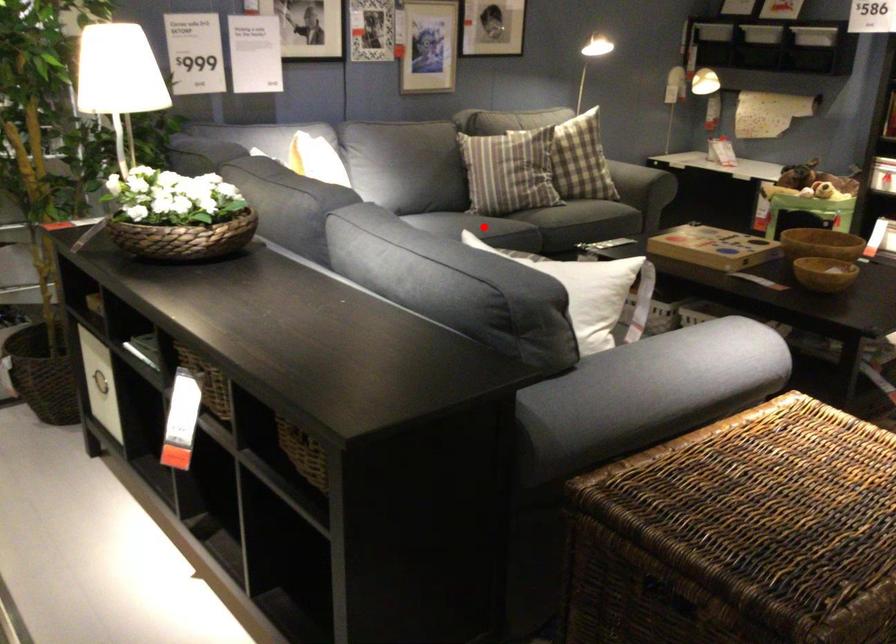
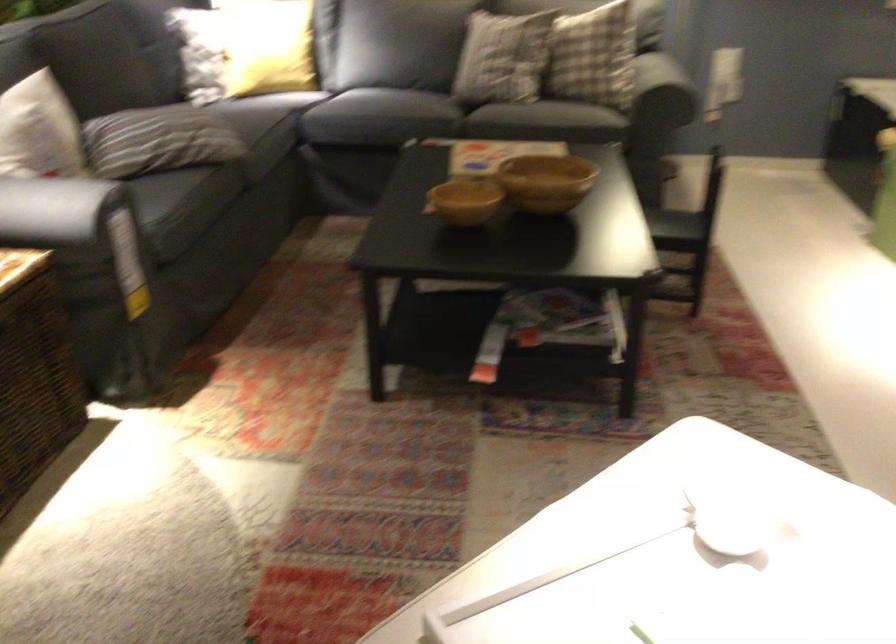
Question: I am providing you with two images of the same scene from different viewpoints. A red point is marked on the first image. Is the red point's position out of view in image 2?

Choices:
 (A) Yes
 (B) No

Answer: (A)